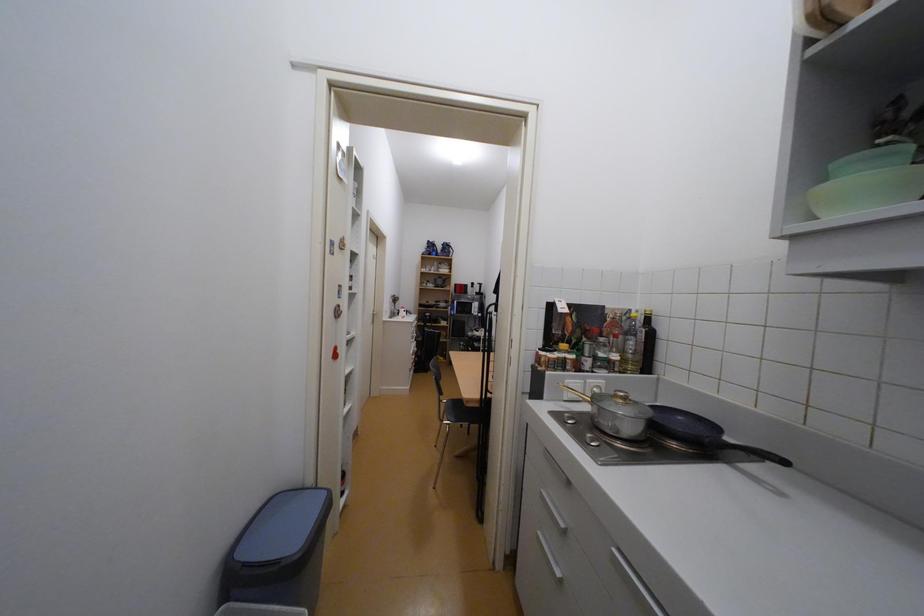
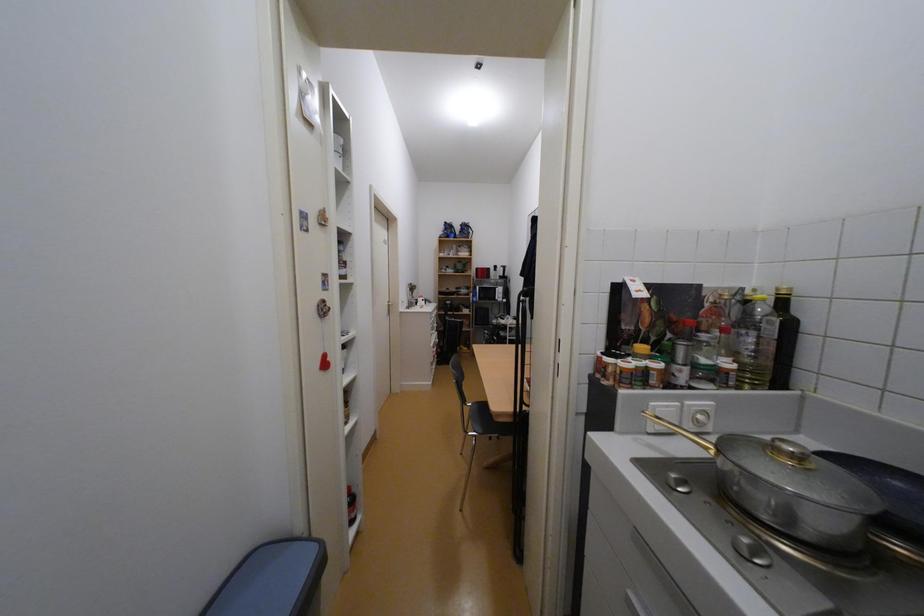
Question: In a continuous first-person perspective shot, in which direction is the camera moving?

Choices:
 (A) Left
 (B) Right
 (C) Forward
 (D) Backward

Answer: (C)